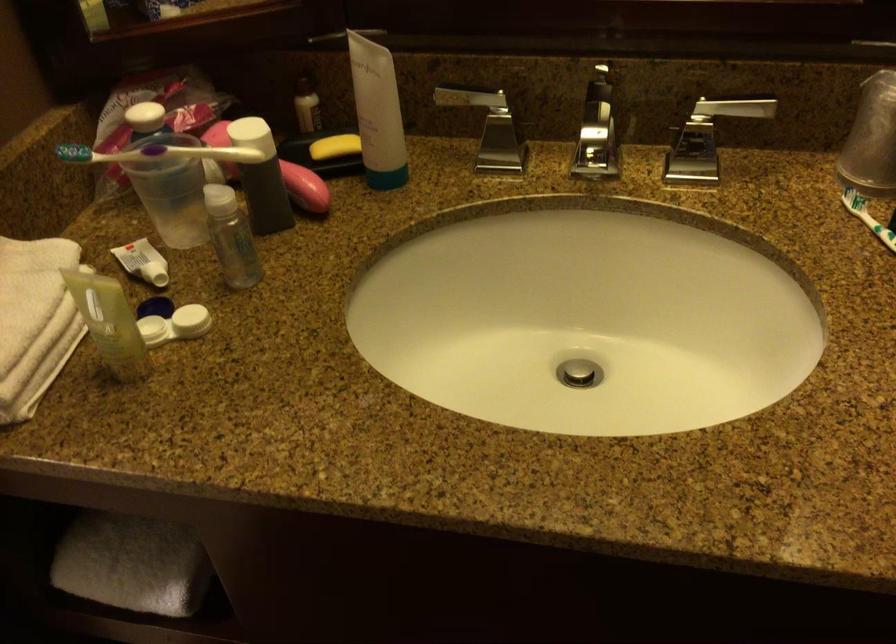
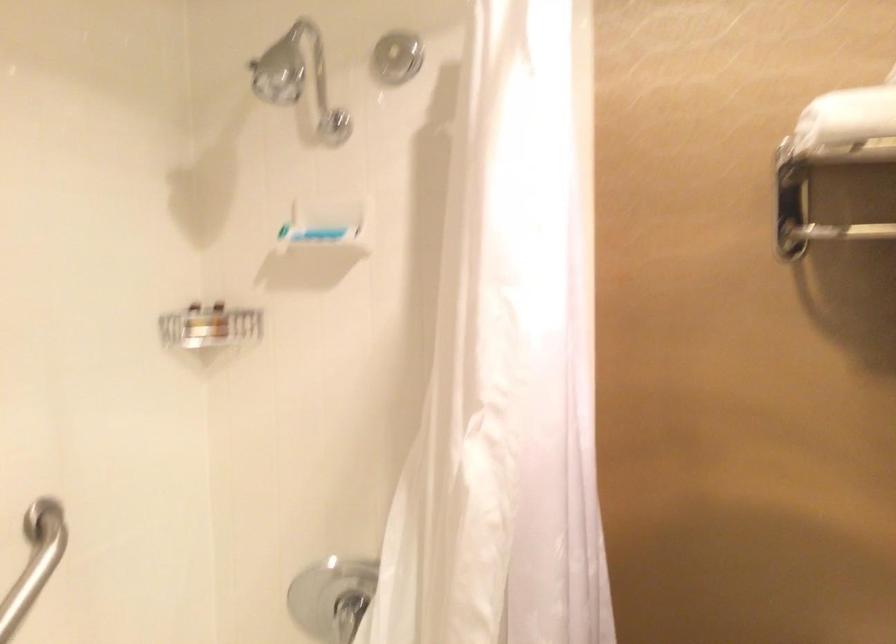
Question: The first image is from the beginning of the video and the second image is from the end. How did the camera likely rotate when shooting the video?

Choices:
 (A) Left
 (B) Right
 (C) Up
 (D) Down

Answer: (A)